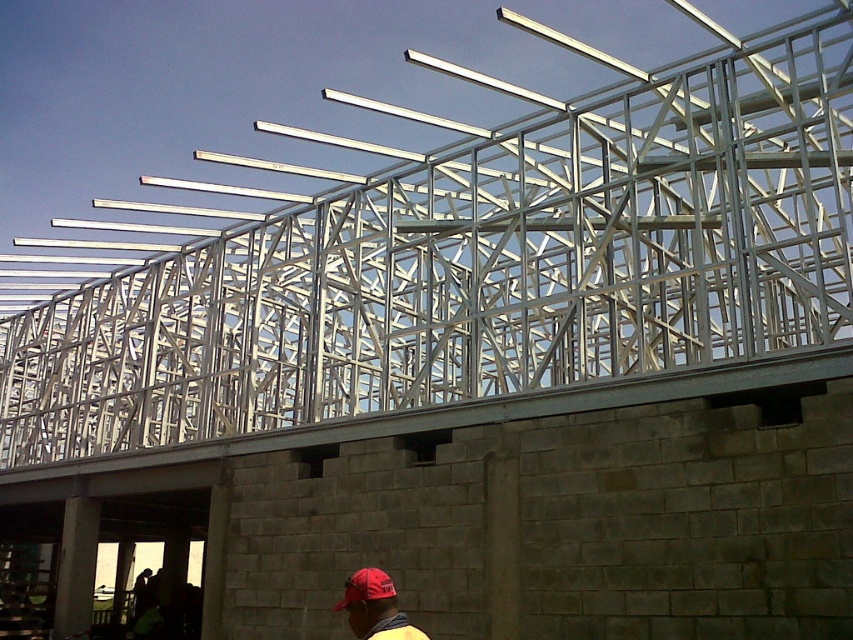
Question: Which object is closer to the camera taking this photo?

Choices:
 (A) matte red cap at lower center
 (B) red matte baseball cap at lower center

Answer: (A)

Question: Is matte red cap at lower center below red matte baseball cap at lower center?

Choices:
 (A) no
 (B) yes

Answer: (B)

Question: Which point is closer to the camera?

Choices:
 (A) red matte baseball cap at lower center
 (B) matte red cap at lower center

Answer: (B)

Question: Which object appears closest to the camera in this image?

Choices:
 (A) matte red cap at lower center
 (B) red matte baseball cap at lower center

Answer: (A)

Question: Can you confirm if matte red cap at lower center is positioned to the right of red matte baseball cap at lower center?

Choices:
 (A) yes
 (B) no

Answer: (A)

Question: Is matte red cap at lower center further to the viewer compared to red matte baseball cap at lower center?

Choices:
 (A) yes
 (B) no

Answer: (B)